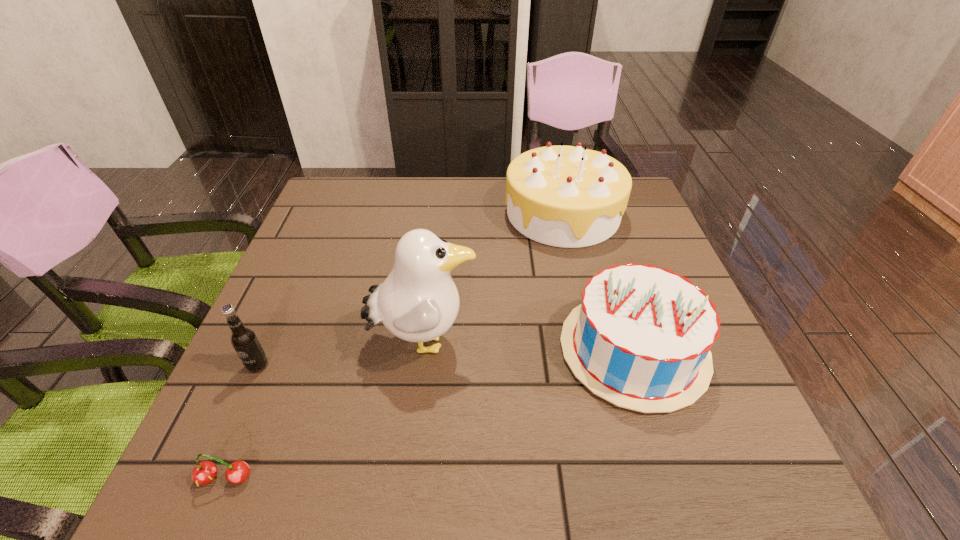
Find the location of a particular element. This screenshot has width=960, height=540. vacant area situated on the label of the root beer is located at coordinates (233, 422).

This screenshot has width=960, height=540. Find the location of `object located in the far edge section of the desktop`. object located in the far edge section of the desktop is located at coordinates (564, 196).

Locate an element on the screen. object present at the near edge is located at coordinates (204, 473).

At what (x,y) coordinates should I click in order to perform the action: click on root beer located at the left edge. Please return your answer as a coordinate pair (x, y). The image size is (960, 540). Looking at the image, I should click on (243, 339).

Find the location of `cherry located at the left edge`. cherry located at the left edge is located at coordinates (204, 473).

Locate an element on the screen. The height and width of the screenshot is (540, 960). object that is at the near left corner is located at coordinates (204, 473).

Identify the location of object situated at the far right corner. (564, 196).

In the image, there is a desktop. Identify the location of vacant space at the far edge. This screenshot has height=540, width=960. coord(461,200).

Image resolution: width=960 pixels, height=540 pixels. I want to click on vacant space at the near edge of the desktop, so click(422, 448).

In the image, there is a desktop. At what (x,y) coordinates should I click in order to perform the action: click on free space at the left edge. Please return your answer as a coordinate pair (x, y). Looking at the image, I should click on (342, 255).